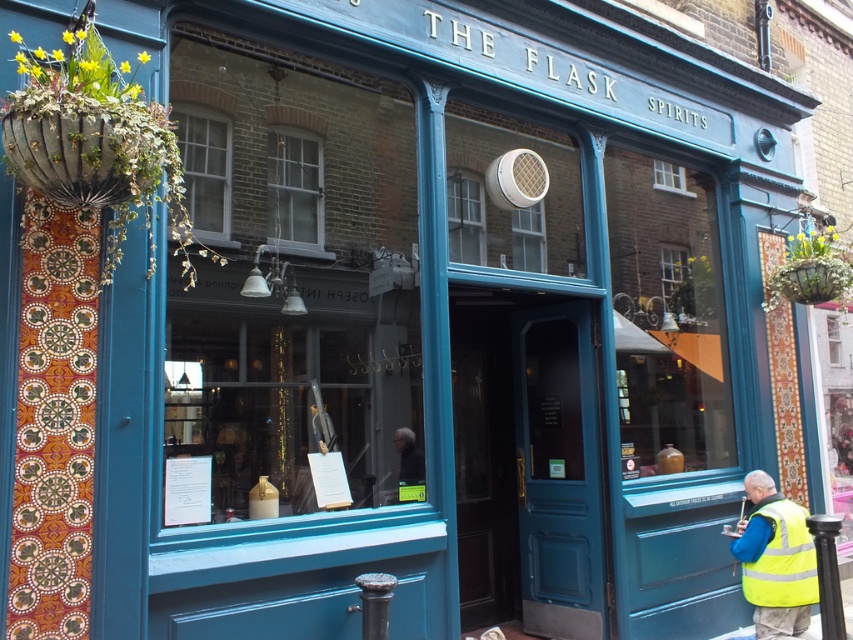
Question: Can you confirm if yellow reflective safety vest at lower right is positioned to the left of dark blue jacket at center?

Choices:
 (A) yes
 (B) no

Answer: (B)

Question: Does yellow reflective safety vest at lower right appear under dark blue jacket at center?

Choices:
 (A) no
 (B) yes

Answer: (B)

Question: Which of the following is the closest to the observer?

Choices:
 (A) dark blue jacket at center
 (B) yellow reflective safety vest at lower right

Answer: (A)

Question: Can you confirm if yellow reflective safety vest at lower right is wider than dark blue jacket at center?

Choices:
 (A) no
 (B) yes

Answer: (B)